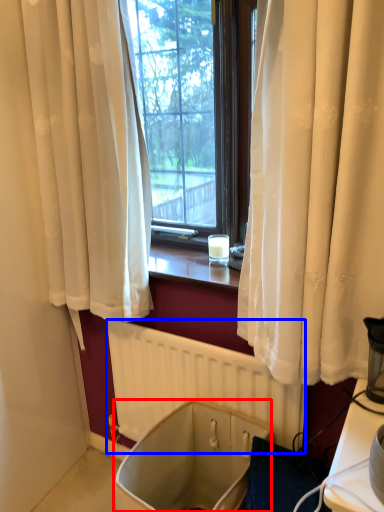
Question: Among these objects, which one is nearest to the camera, bath (highlighted by a red box) or radiator (highlighted by a blue box)?

Choices:
 (A) bath
 (B) radiator

Answer: (A)